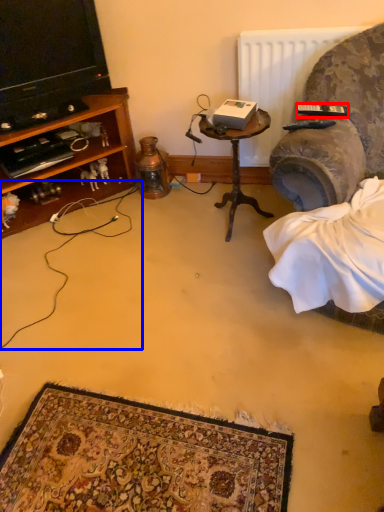
Question: Which of the following is the farthest to the observer, remote control (highlighted by a red box) or string (highlighted by a blue box)?

Choices:
 (A) remote control
 (B) string

Answer: (A)